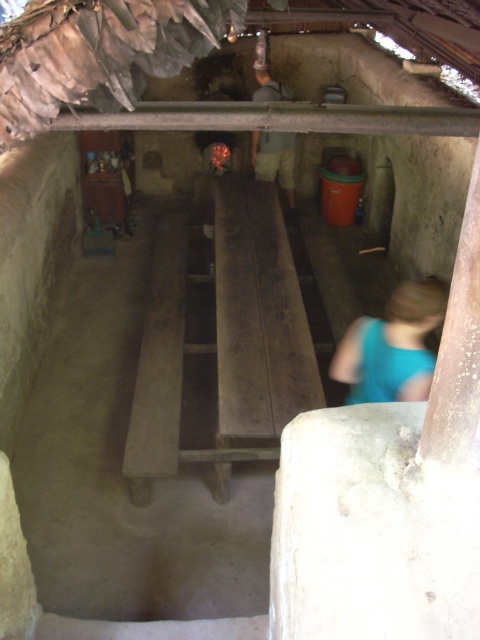
Question: Is smooth wooden beam at upper center thinner than light brown shorts at center?

Choices:
 (A) yes
 (B) no

Answer: (B)

Question: Which point is farther from the camera taking this photo?

Choices:
 (A) (436, 280)
 (B) (256, 104)
 (C) (268, 81)

Answer: (C)

Question: Which object is the closest to the light brown shorts at center?

Choices:
 (A) smooth wooden beam at upper center
 (B) blue fabric at lower right

Answer: (A)

Question: Can you confirm if blue fabric at lower right is positioned below light brown shorts at center?

Choices:
 (A) no
 (B) yes

Answer: (B)

Question: Is blue fabric at lower right smaller than light brown shorts at center?

Choices:
 (A) no
 (B) yes

Answer: (B)

Question: Which point is farther to the camera?

Choices:
 (A) smooth wooden beam at upper center
 (B) light brown shorts at center

Answer: (B)